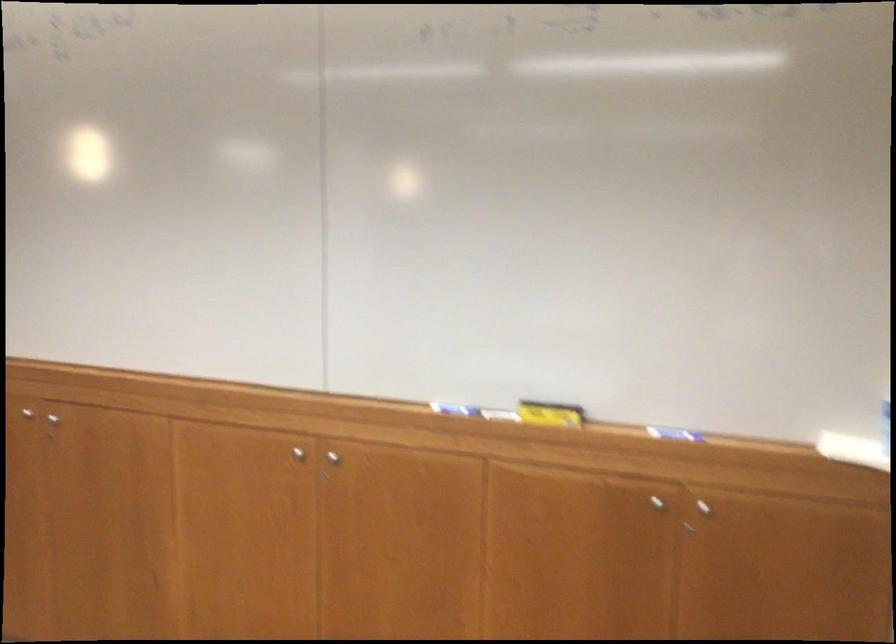
Where is `yellow whiteboard eraser`? The width and height of the screenshot is (896, 644). yellow whiteboard eraser is located at coordinates (549, 413).